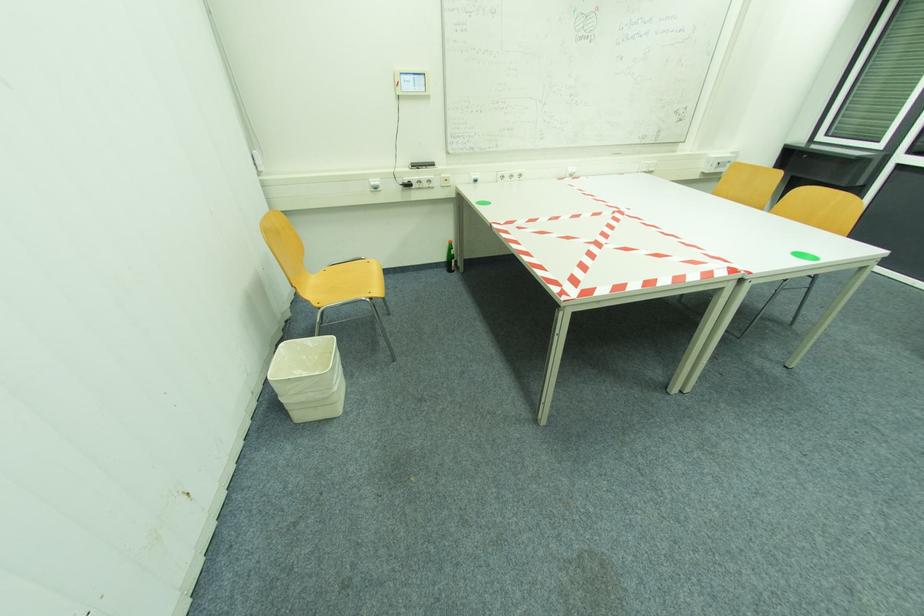
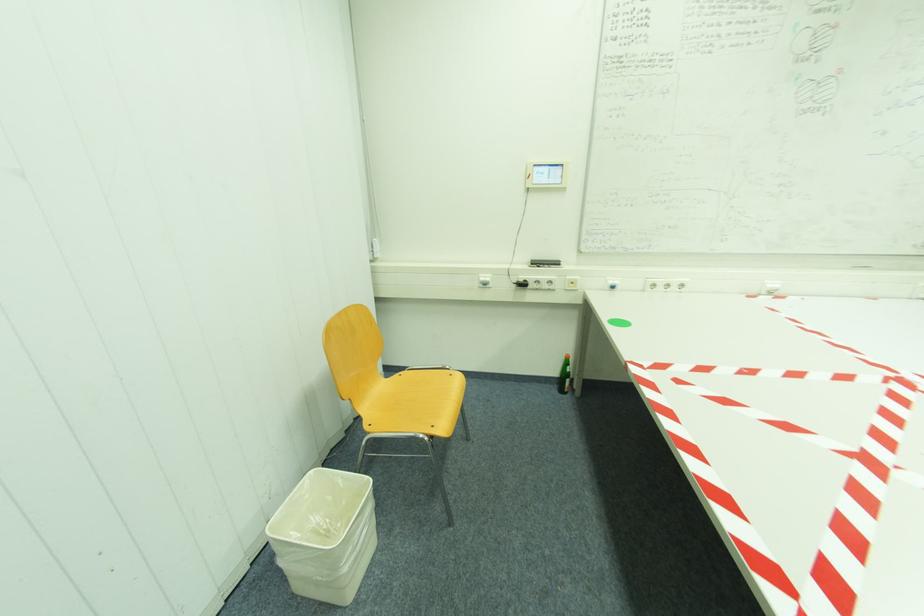
Question: The images are taken continuously from a first-person perspective. In which direction are you moving?

Choices:
 (A) Left
 (B) Right
 (C) Forward
 (D) Backward

Answer: (C)